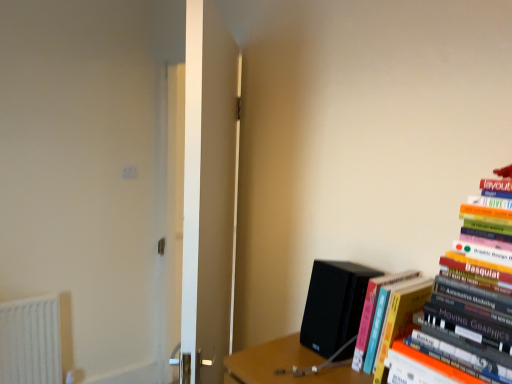
Question: Would you say hardcover books at right, positioned as the second book in back-to-front order, is inside or outside black matte speaker at lower right?

Choices:
 (A) inside
 (B) outside

Answer: (B)

Question: Would you say hardcover books at right, positioned as the second book in back-to-front order, is to the left or to the right of black matte speaker at lower right in the picture?

Choices:
 (A) left
 (B) right

Answer: (B)

Question: Based on their relative distances, which object is farther from the white glossy door at center?

Choices:
 (A) black matte speaker at lower right
 (B) hardcover books at right, positioned as the second book in back-to-front order
 (C) orange matte book at right, which is the second book from front to back

Answer: (B)

Question: Considering the real-world distances, which object is farthest from the white glossy door at center?

Choices:
 (A) hardcover books at right, positioned as the second book in back-to-front order
 (B) black matte speaker at lower right
 (C) orange matte book at right, which appears as the first book when viewed from the back

Answer: (A)